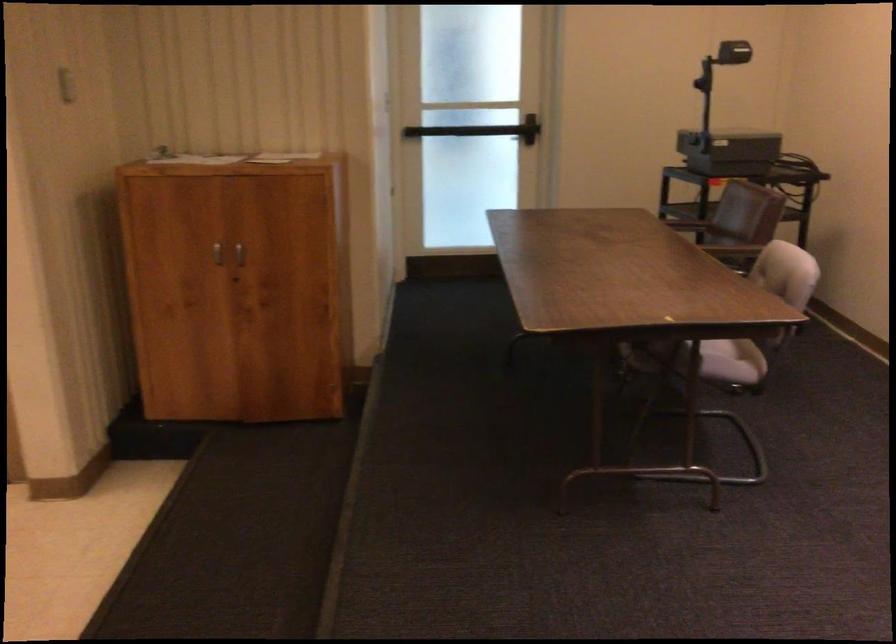
Identify the location of door push bar. (479, 129).